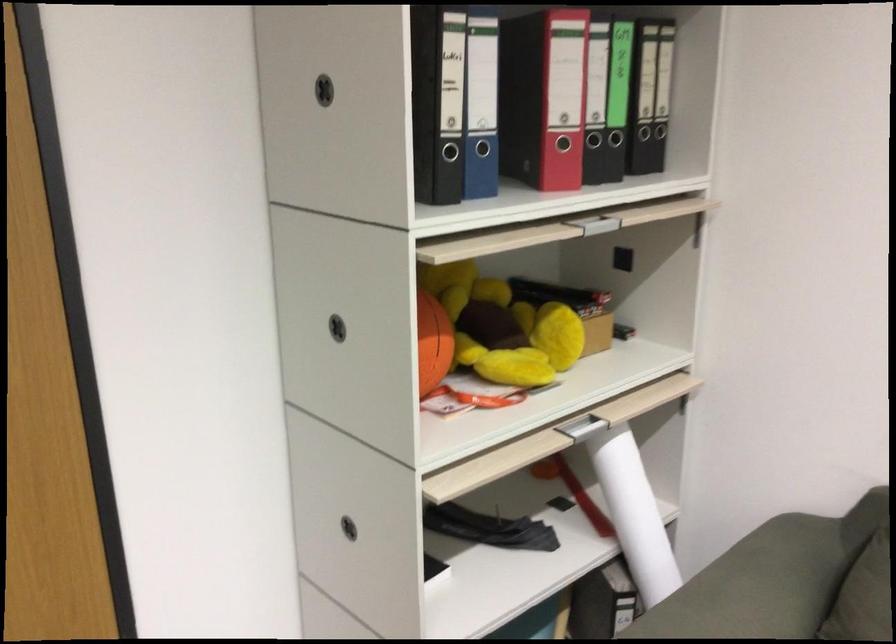
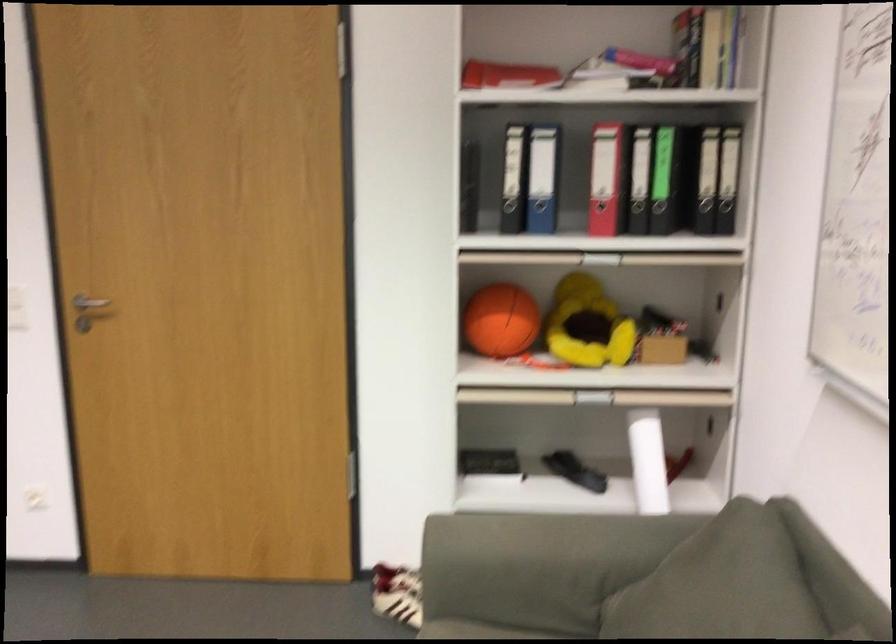
Locate, in the second image, the point that corresponds to [474,174] in the first image.

(539, 216)